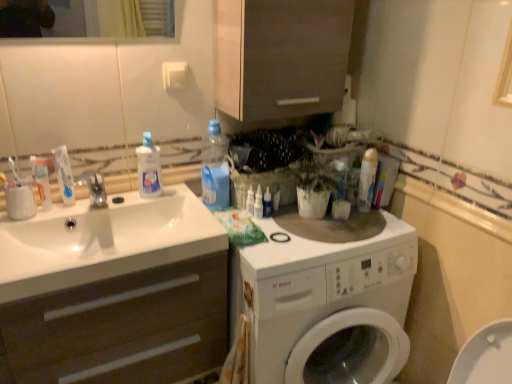
The width and height of the screenshot is (512, 384). I want to click on unoccupied region to the right of transparent plastic bottle at upper left, the 1th cleaning product from the left, so click(193, 203).